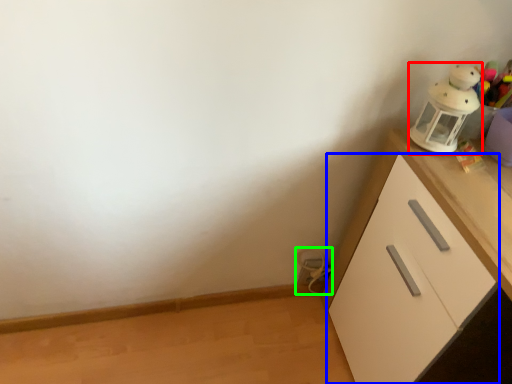
Question: Considering the real-world distances, which object is farthest from toy (highlighted by a red box)? cabinetry (highlighted by a blue box) or toy (highlighted by a green box)?

Choices:
 (A) cabinetry
 (B) toy

Answer: (B)